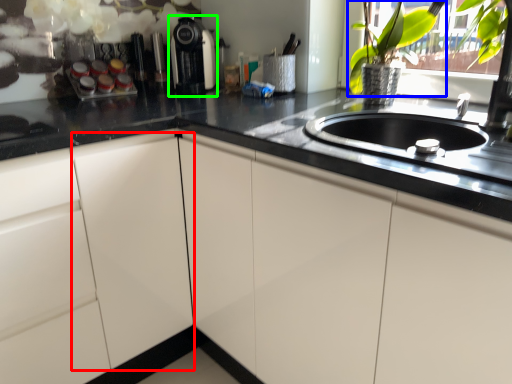
Question: Which is farther away from cabinetry (highlighted by a red box)? floral arrangement (highlighted by a blue box) or coffee machine (highlighted by a green box)?

Choices:
 (A) floral arrangement
 (B) coffee machine

Answer: (A)